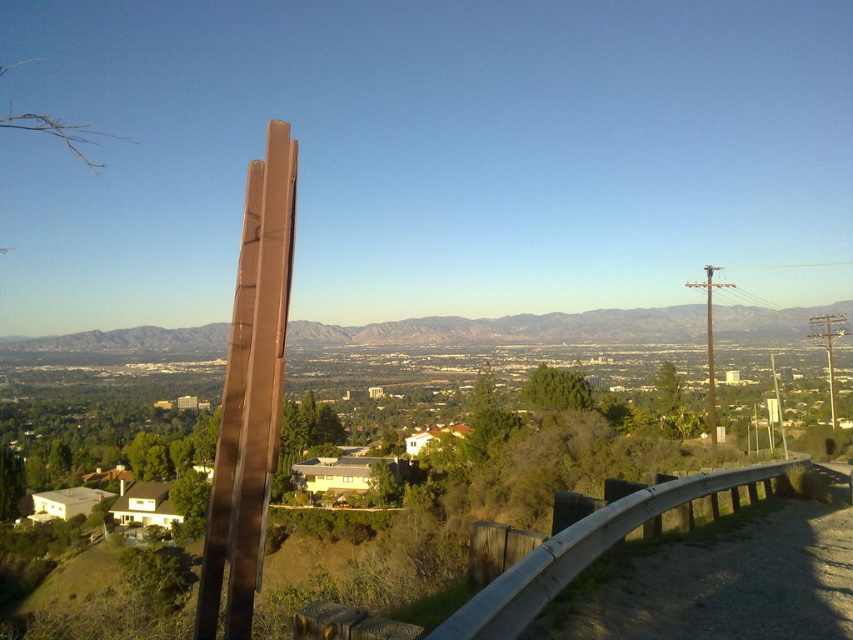
Question: Which of the following is the closest to the observer?

Choices:
 (A) (374, 323)
 (B) (242, 408)

Answer: (B)

Question: Can you confirm if brown polished wood at center is positioned to the right of brown matte mountain at center?

Choices:
 (A) yes
 (B) no

Answer: (A)

Question: Can you confirm if brown polished wood at center is positioned below brown matte mountain at center?

Choices:
 (A) no
 (B) yes

Answer: (A)

Question: Can you confirm if brown polished wood at center is bigger than brown matte mountain at center?

Choices:
 (A) no
 (B) yes

Answer: (A)

Question: Among these objects, which one is nearest to the camera?

Choices:
 (A) brown matte mountain at center
 (B) brown polished wood at center

Answer: (B)